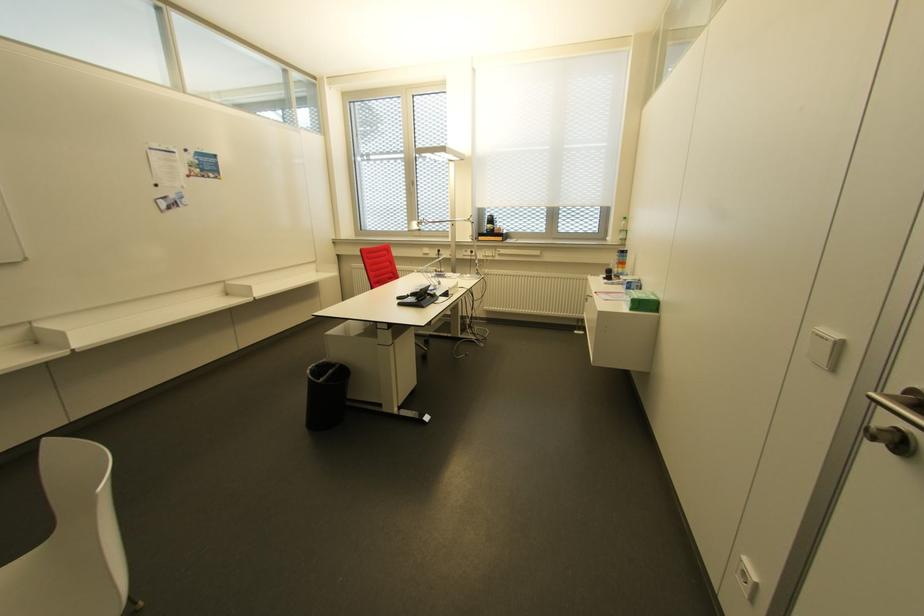
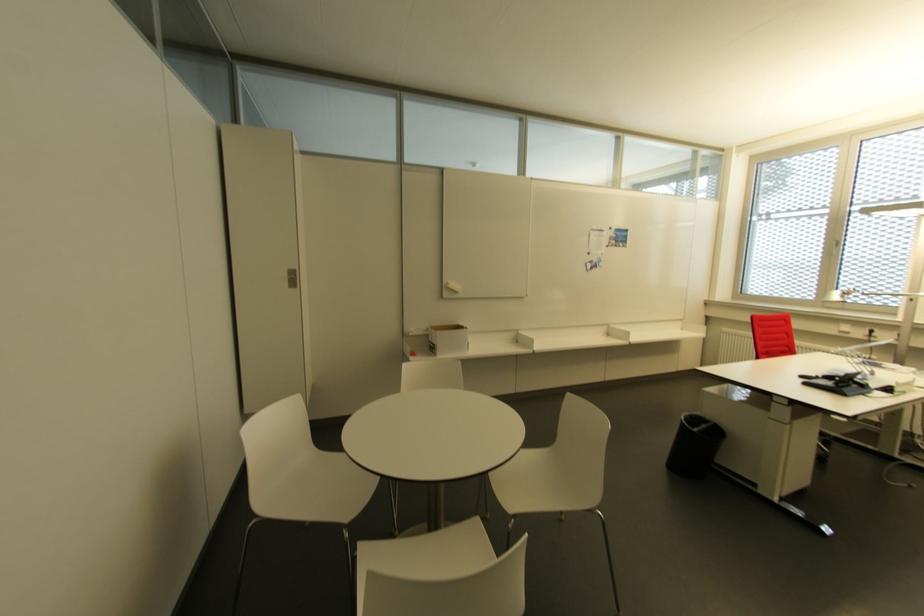
Question: The images are taken continuously from a first-person perspective. In which direction is your viewpoint rotating?

Choices:
 (A) Left
 (B) Right
 (C) Up
 (D) Down

Answer: (A)